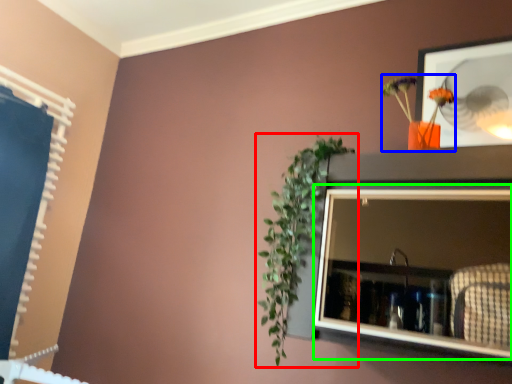
Question: Which is nearer to the houseplant (highlighted by a red box)? floral arrangement (highlighted by a blue box) or medicine cabinet (highlighted by a green box).

Choices:
 (A) floral arrangement
 (B) medicine cabinet

Answer: (B)